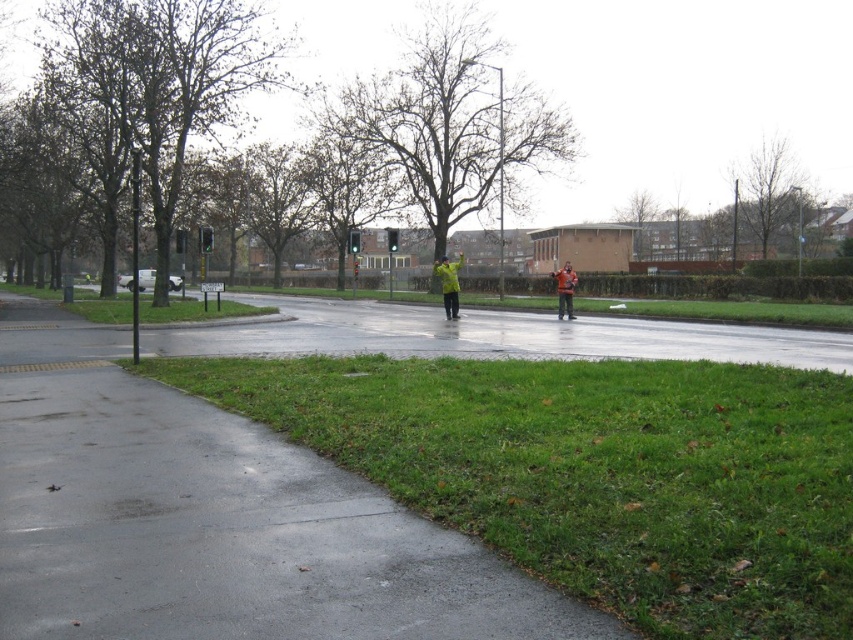
Who is taller, green grass at lower right or orange fabric jacket at center?

orange fabric jacket at center is taller.

Can you confirm if green grass at lower right is bigger than orange fabric jacket at center?

No.

This screenshot has width=853, height=640. In order to click on green grass at lower right in this screenshot , I will do [x=595, y=472].

Image resolution: width=853 pixels, height=640 pixels. Identify the location of green grass at lower right. (595, 472).

Does green grass at lower right have a greater width compared to yellow reflective jacket at center?

Indeed, green grass at lower right has a greater width compared to yellow reflective jacket at center.

Is point (552, 580) farther from viewer compared to point (451, 275)?

That is False.

Between point (631, 497) and point (444, 291), which one is positioned behind?

Positioned behind is point (444, 291).

At what (x,y) coordinates should I click in order to perform the action: click on green grass at lower right. Please return your answer as a coordinate pair (x, y). Image resolution: width=853 pixels, height=640 pixels. Looking at the image, I should click on (595, 472).

Describe the element at coordinates (450, 284) in the screenshot. I see `yellow reflective jacket at center` at that location.

Measure the distance between yellow reflective jacket at center and camera.

A distance of 87.64 feet exists between yellow reflective jacket at center and camera.

Locate an element on the screen. The image size is (853, 640). yellow reflective jacket at center is located at coordinates (450, 284).

Identify the location of yellow reflective jacket at center. Image resolution: width=853 pixels, height=640 pixels. (450, 284).